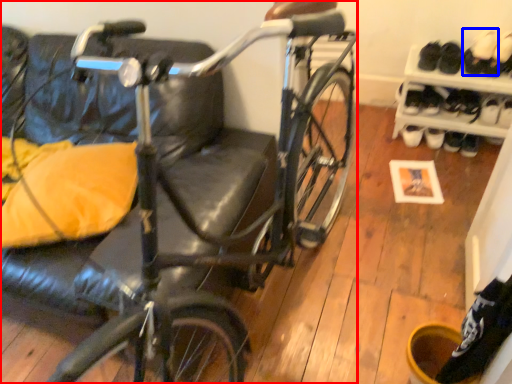
Question: Which object is further to the camera taking this photo, bicycle (highlighted by a red box) or footwear (highlighted by a blue box)?

Choices:
 (A) bicycle
 (B) footwear

Answer: (B)